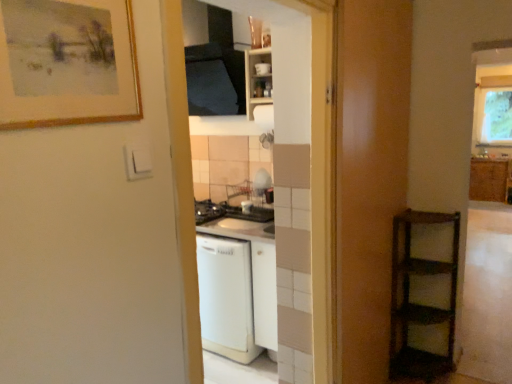
Question: Considering the relative positions of white matte cabinet at upper center, marked as the 2th cabinetry in a back-to-front arrangement, and clear glass window at upper right in the image provided, is white matte cabinet at upper center, marked as the 2th cabinetry in a back-to-front arrangement, to the right of clear glass window at upper right from the viewer's perspective?

Choices:
 (A) no
 (B) yes

Answer: (A)

Question: Does white matte cabinet at upper center, marked as the 2th cabinetry in a back-to-front arrangement, have a greater width compared to clear glass window at upper right?

Choices:
 (A) no
 (B) yes

Answer: (B)

Question: Can you confirm if white matte cabinet at upper center, positioned as the second cabinetry in right-to-left order, is taller than clear glass window at upper right?

Choices:
 (A) yes
 (B) no

Answer: (B)

Question: Is white matte cabinet at upper center, positioned as the second cabinetry in right-to-left order, aimed at clear glass window at upper right?

Choices:
 (A) no
 (B) yes

Answer: (A)

Question: Is white matte cabinet at upper center, placed as the 1th cabinetry when sorted from front to back, positioned with its back to clear glass window at upper right?

Choices:
 (A) yes
 (B) no

Answer: (A)

Question: Can you confirm if white matte cabinet at upper center, arranged as the first cabinetry when viewed from the left, is thinner than clear glass window at upper right?

Choices:
 (A) yes
 (B) no

Answer: (B)

Question: From a real-world perspective, is wooden-framed painting at upper left beneath wooden cabinet at right, the 1th cabinetry in the right-to-left sequence?

Choices:
 (A) no
 (B) yes

Answer: (A)

Question: Is wooden-framed painting at upper left behind wooden cabinet at right, placed as the second cabinetry when sorted from front to back?

Choices:
 (A) no
 (B) yes

Answer: (A)

Question: Can you confirm if wooden-framed painting at upper left is thinner than wooden cabinet at right, the 1th cabinetry in the right-to-left sequence?

Choices:
 (A) no
 (B) yes

Answer: (B)

Question: Is wooden-framed painting at upper left taller than wooden cabinet at right, the 1th cabinetry in the right-to-left sequence?

Choices:
 (A) yes
 (B) no

Answer: (B)

Question: Considering the relative sizes of wooden-framed painting at upper left and wooden cabinet at right, placed as the second cabinetry when sorted from front to back, in the image provided, is wooden-framed painting at upper left wider than wooden cabinet at right, placed as the second cabinetry when sorted from front to back,?

Choices:
 (A) no
 (B) yes

Answer: (A)

Question: Is wooden-framed painting at upper left closer to the viewer compared to wooden cabinet at right, the 1th cabinetry in the right-to-left sequence?

Choices:
 (A) yes
 (B) no

Answer: (A)

Question: Considering the relative sizes of white glossy dishwasher at center, marked as the first screen door in a left-to-right arrangement, and wooden-framed painting at upper left in the image provided, is white glossy dishwasher at center, marked as the first screen door in a left-to-right arrangement, bigger than wooden-framed painting at upper left?

Choices:
 (A) no
 (B) yes

Answer: (B)